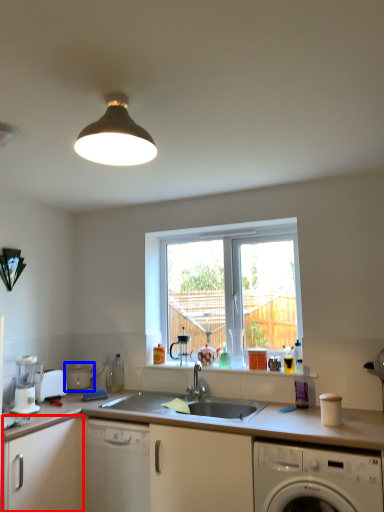
Question: Which of the following is the farthest to the observer, cabinetry (highlighted by a red box) or appliance (highlighted by a blue box)?

Choices:
 (A) cabinetry
 (B) appliance

Answer: (B)